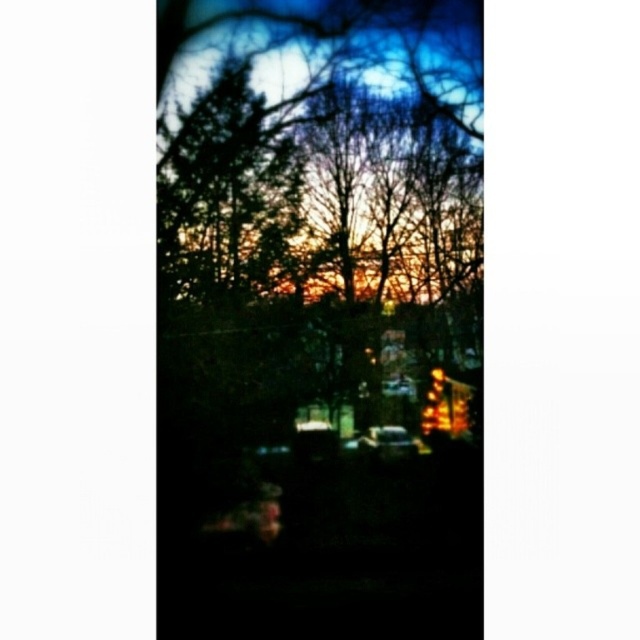
Which is below, silhouetted bare branches at center or shiny silver car at center?

shiny silver car at center

Is point (392, 161) closer to viewer compared to point (378, 429)?

Yes, it is.

Describe the element at coordinates (323, 216) in the screenshot. Image resolution: width=640 pixels, height=640 pixels. I see `silhouetted bare branches at center` at that location.

The width and height of the screenshot is (640, 640). What are the coordinates of `silhouetted bare branches at center` in the screenshot? It's located at (323, 216).